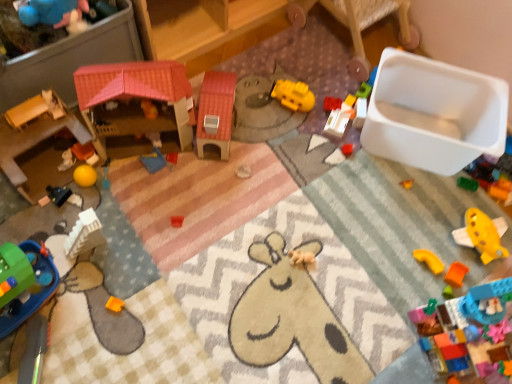
Identify the location of vacant position to the left of white plastic container at center, acting as the 10th toy starting from the left. The image size is (512, 384). (292, 129).